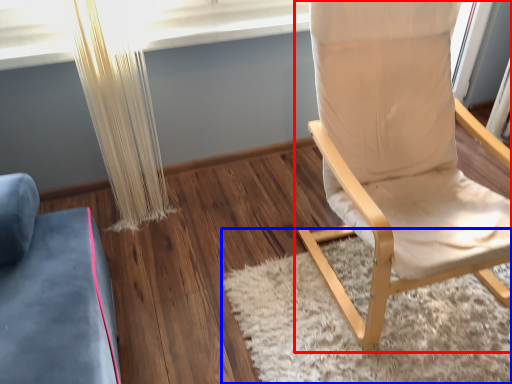
Question: Which object is closer to the camera taking this photo, chair (highlighted by a red box) or mat (highlighted by a blue box)?

Choices:
 (A) chair
 (B) mat

Answer: (A)